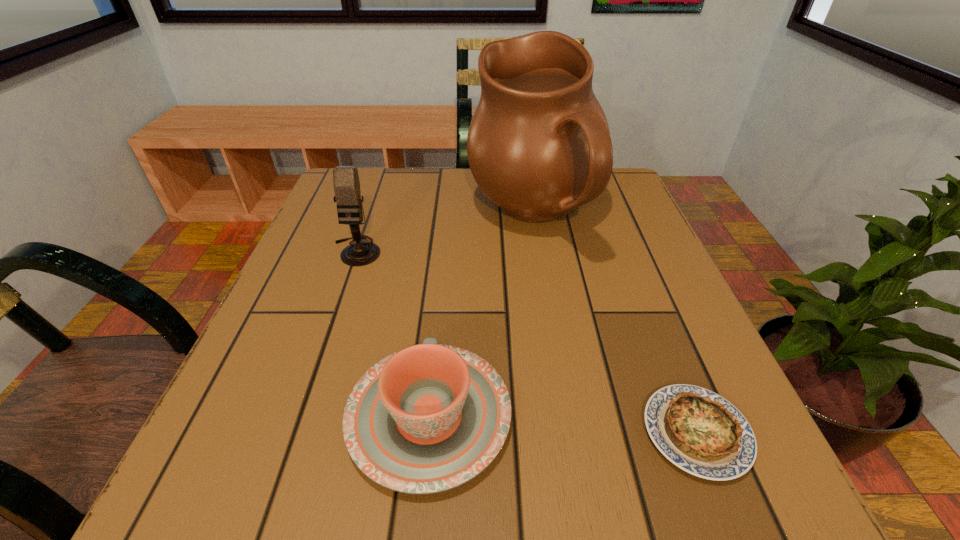
Identify the location of the tallest object. (538, 146).

Locate an element on the screen. The image size is (960, 540). the second tallest object is located at coordinates (346, 182).

At what (x,y) coordinates should I click in order to perform the action: click on the leftmost object. Please return your answer as a coordinate pair (x, y). Looking at the image, I should click on (346, 182).

Find the location of `chinaware`. chinaware is located at coordinates (426, 419).

The height and width of the screenshot is (540, 960). Identify the location of quiche. (699, 431).

This screenshot has width=960, height=540. Identify the location of free spot located at the spout of the tallest object. (336, 215).

Where is `vacant space located 0.050m at the spout of the tallest object`? Image resolution: width=960 pixels, height=540 pixels. vacant space located 0.050m at the spout of the tallest object is located at coordinates (445, 215).

I want to click on vacant space situated 0.340m at the spout of the tallest object, so coord(318,215).

Where is `vacant region located 0.100m on the front-facing side of the third shortest object`? This screenshot has height=540, width=960. vacant region located 0.100m on the front-facing side of the third shortest object is located at coordinates (339, 302).

Locate an element on the screen. blank space located on the handle side of the second shortest object is located at coordinates (442, 293).